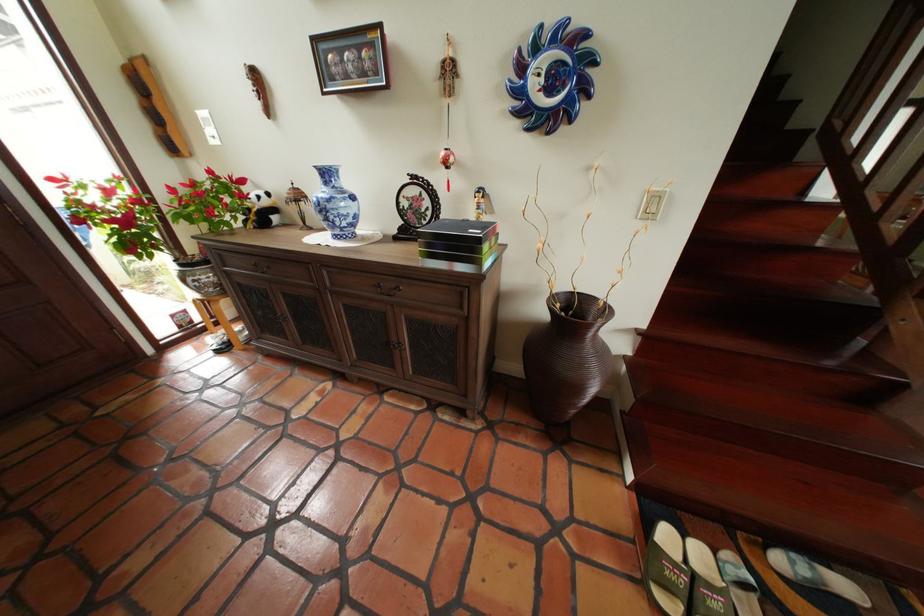
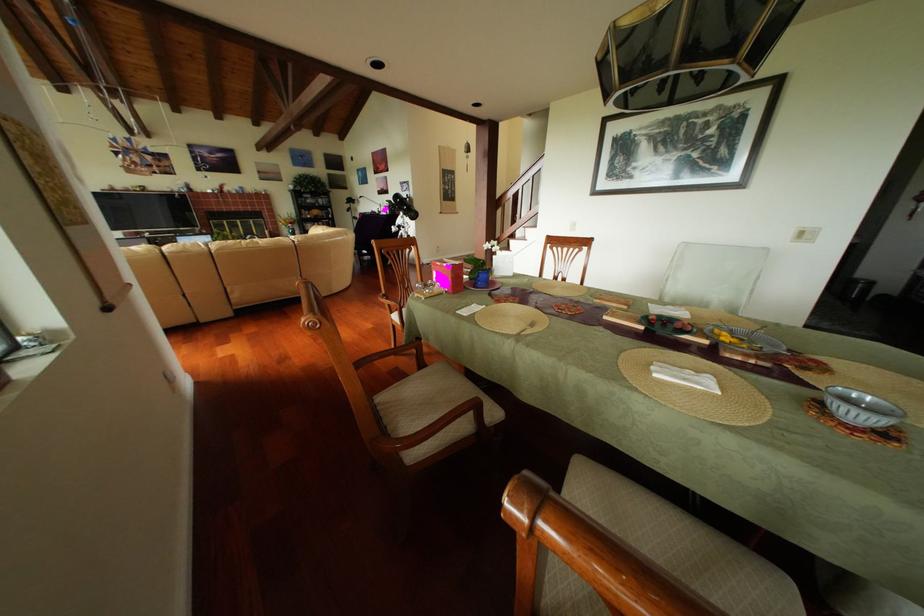
Question: I am providing you with two images of the same scene from different viewpoints. Which of the following objects are not visible in image2?

Choices:
 (A) drawer handle
 (B) grey shoe box
 (C) clear glass bowl
 (D) wooden chair armrest

Answer: (A)